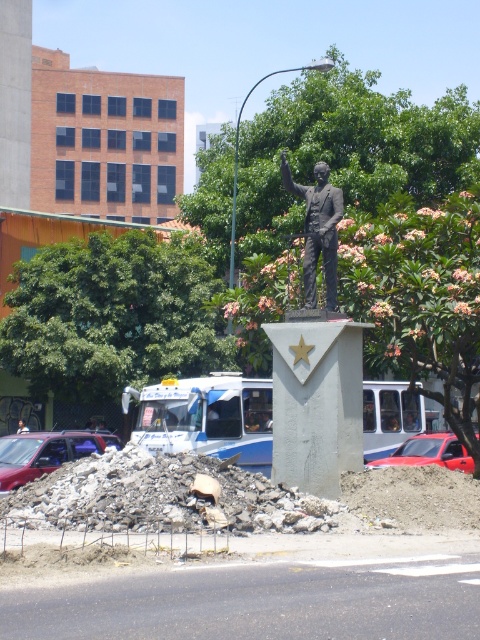
You are a delivery driver who needs to park your truck near the statue. The truck is too large to fit between the rubble concrete at center and the matte red car at lower left. Where should you park your truck?

The rubble concrete at center is located below the matte red car at lower left, so the truck should be parked behind the matte red car at lower left to avoid the rubble concrete at center.

You are a delivery driver who needs to park your shiny red car at center near the statue. The statue is the blurred plastic man at center. Can you park your car to the left of the statue without moving any debris?

The shiny red car at center is already positioned on the right side of the blurred plastic man at center. To park to the left of the statue, you would need to move the car to the left side, but there might be debris in that area. Since the question doesn not mention debris clearance, it is uncertain if the space is available. However, based on the current arrangement, the car is on the right, so parking to the left would require repositioning.

You are a delivery driver who needs to navigate through the area shown in the image. There is rubble concrete at center and a matte red car at lower left. Which obstacle is taller and would block your path more if you need to drive over them?

The rubble concrete at center is taller than the matte red car at lower left, so it would block your path more if you need to drive over them.